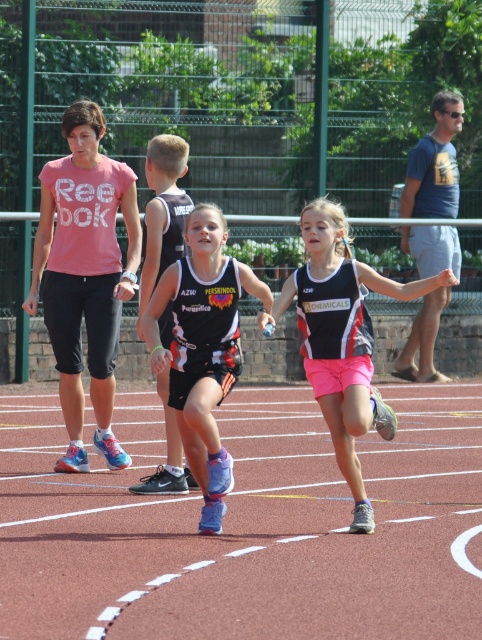
Is matte black tank top at center to the right of black jersey at center from the viewer's perspective?

Indeed, matte black tank top at center is positioned on the right side of black jersey at center.

Between matte black tank top at center and black jersey at center, which one is positioned higher?

matte black tank top at center

Find the location of a particular element. This screenshot has height=640, width=482. matte black tank top at center is located at coordinates (343, 337).

At what (x,y) coordinates should I click in order to perform the action: click on matte black tank top at center. Please return your answer as a coordinate pair (x, y). Image resolution: width=482 pixels, height=640 pixels. Looking at the image, I should click on (343, 337).

Is point (102, 314) positioned in front of point (383, 420)?

No, it is behind (383, 420).

Who is shorter, pink matte t-shirt at left or matte black tank top at center?

matte black tank top at center

Between point (94, 209) and point (411, 298), which one is positioned in front?

Point (411, 298)

Where is `pink matte t-shirt at left`? The image size is (482, 640). pink matte t-shirt at left is located at coordinates (84, 275).

Does pink matte t-shirt at left lie behind black jersey at center?

Yes, pink matte t-shirt at left is further from the viewer.

Does pink matte t-shirt at left have a lesser height compared to black jersey at center?

No.

Locate an element on the screen. pink matte t-shirt at left is located at coordinates (84, 275).

You are a GUI agent. You are given a task and a screenshot of the screen. Output one action in this format:
    pyautogui.click(x=<x>, y=<y>)
    Task: Click on the pink matte t-shirt at left
    
    Given the screenshot: What is the action you would take?
    pyautogui.click(x=84, y=275)